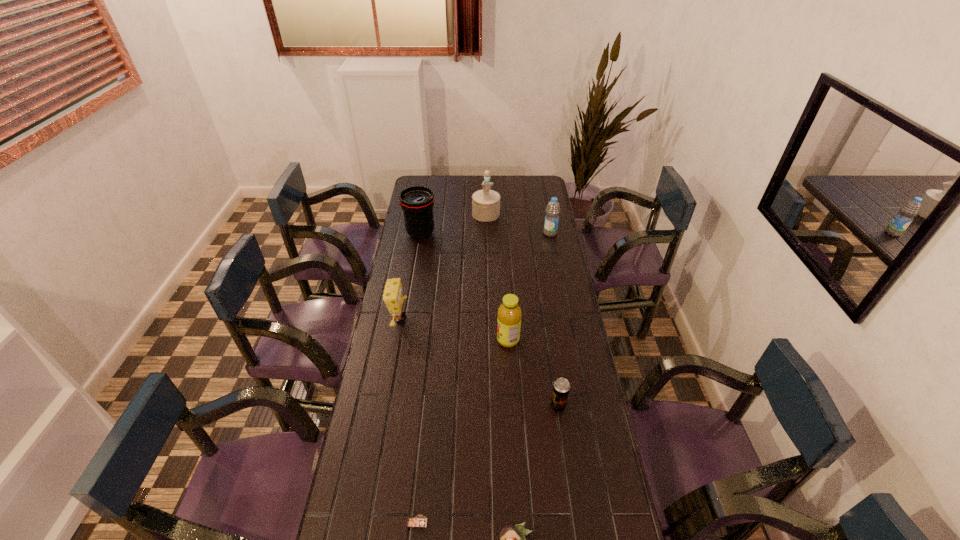
The width and height of the screenshot is (960, 540). In order to click on water bottle that is at the right edge in this screenshot , I will do `click(550, 228)`.

Identify the location of beer can present at the right edge. The height and width of the screenshot is (540, 960). (561, 387).

The image size is (960, 540). Find the location of `blank space at the far edge`. blank space at the far edge is located at coordinates (442, 179).

This screenshot has width=960, height=540. I want to click on vacant area at the left edge of the desktop, so click(402, 226).

The image size is (960, 540). What are the coordinates of `vacant area at the right edge of the desktop` in the screenshot? It's located at tap(541, 241).

This screenshot has width=960, height=540. In the image, there is a desktop. In order to click on vacant space at the far left corner in this screenshot , I will do `click(421, 182)`.

Where is `free space at the far right corner of the desktop`? The image size is (960, 540). free space at the far right corner of the desktop is located at coordinates (519, 178).

Find the location of a particular element. vacant space in between the rightmost object and the farthest object is located at coordinates (518, 224).

What are the coordinates of `vacant space in between the fruit juice and the rightmost object` in the screenshot? It's located at (529, 287).

Identify the location of free space between the fruit juice and the second nearest object. (463, 431).